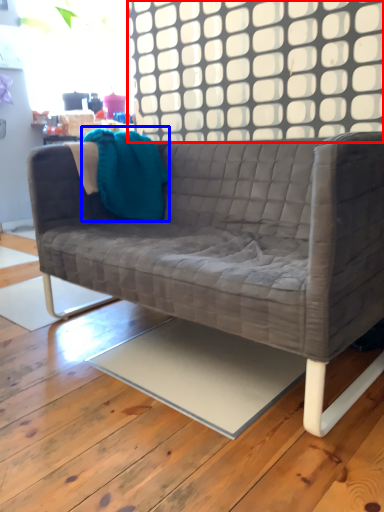
Question: Which object is closer to the camera taking this photo, window (highlighted by a red box) or throw pillow (highlighted by a blue box)?

Choices:
 (A) window
 (B) throw pillow

Answer: (A)